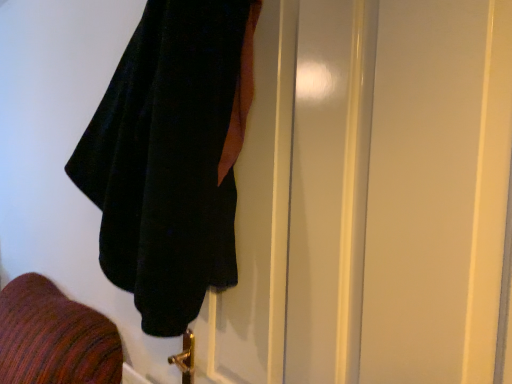
The image size is (512, 384). Find the location of `velvet black towel at upper left`. velvet black towel at upper left is located at coordinates (170, 157).

What do you see at coordinates (170, 157) in the screenshot? I see `velvet black towel at upper left` at bounding box center [170, 157].

Measure the distance between velvet black towel at upper left and camera.

28.39 inches.

The height and width of the screenshot is (384, 512). What do you see at coordinates (405, 187) in the screenshot? I see `velvet black coat at upper left` at bounding box center [405, 187].

This screenshot has height=384, width=512. In order to click on velvet black coat at upper left in this screenshot , I will do 405,187.

Find the location of a particular element. The image size is (512, 384). velvet black towel at upper left is located at coordinates (170, 157).

From the picture: Which is more to the right, velvet black towel at upper left or velvet black coat at upper left?

Positioned to the right is velvet black coat at upper left.

Is velvet black towel at upper left in front of velvet black coat at upper left?

No, the depth of velvet black towel at upper left is greater than that of velvet black coat at upper left.

Considering the positions of points (170, 158) and (384, 381), is point (170, 158) farther from camera compared to point (384, 381)?

Yes, point (170, 158) is behind point (384, 381).

From the image's perspective, which one is positioned higher, velvet black towel at upper left or velvet black coat at upper left?

velvet black towel at upper left.

From a real-world perspective, between velvet black towel at upper left and velvet black coat at upper left, who is vertically higher?

velvet black towel at upper left, from a real-world perspective.

Looking at their sizes, would you say velvet black towel at upper left is wider or thinner than velvet black coat at upper left?

Considering their sizes, velvet black towel at upper left looks broader than velvet black coat at upper left.

Which of these two, velvet black towel at upper left or velvet black coat at upper left, stands taller?

velvet black coat at upper left.

Is velvet black towel at upper left bigger than velvet black coat at upper left?

Yes, velvet black towel at upper left is bigger than velvet black coat at upper left.

Is velvet black towel at upper left spatially inside velvet black coat at upper left, or outside of it?

velvet black towel at upper left is not enclosed by velvet black coat at upper left.

Is velvet black towel at upper left far from velvet black coat at upper left?

velvet black towel at upper left is actually quite close to velvet black coat at upper left.

Is velvet black towel at upper left facing towards velvet black coat at upper left?

No, velvet black towel at upper left is not oriented towards velvet black coat at upper left.

Can you tell me how much velvet black towel at upper left and velvet black coat at upper left differ in facing direction?

10.1 degrees separate the facing orientations of velvet black towel at upper left and velvet black coat at upper left.

Where is `towel above the velvet black coat at upper left (from a real-world perspective)`? The height and width of the screenshot is (384, 512). towel above the velvet black coat at upper left (from a real-world perspective) is located at coordinates (170, 157).

Looking at this image, between velvet black coat at upper left and velvet black towel at upper left, which one appears on the left side from the viewer's perspective?

velvet black towel at upper left.

Between velvet black coat at upper left and velvet black towel at upper left, which one is positioned behind?

velvet black towel at upper left is further from the camera.

Does point (380, 342) come behind point (248, 33)?

No.

From the image's perspective, is velvet black coat at upper left positioned above or below velvet black towel at upper left?

From the image's perspective, velvet black coat at upper left appears below velvet black towel at upper left.

Consider the image. From a real-world perspective, which is physically above, velvet black coat at upper left or velvet black towel at upper left?

In real-world perspective, velvet black towel at upper left is above.

Consider the image. Which object is wider, velvet black coat at upper left or velvet black towel at upper left?

velvet black towel at upper left is wider.

Which of these two, velvet black coat at upper left or velvet black towel at upper left, stands shorter?

velvet black towel at upper left is shorter.

Based on their sizes in the image, would you say velvet black coat at upper left is bigger or smaller than velvet black towel at upper left?

In the image, velvet black coat at upper left appears to be smaller than velvet black towel at upper left.

Is velvet black coat at upper left inside or outside of velvet black towel at upper left?

velvet black coat at upper left is located beyond the bounds of velvet black towel at upper left.

Are velvet black coat at upper left and velvet black towel at upper left far apart?

No, velvet black coat at upper left is not far away from velvet black towel at upper left.

Is velvet black coat at upper left facing away from velvet black towel at upper left?

That's not correct — velvet black coat at upper left is not looking away from velvet black towel at upper left.

Can you tell me how much velvet black coat at upper left and velvet black towel at upper left differ in facing direction?

The angle between the facing direction of velvet black coat at upper left and the facing direction of velvet black towel at upper left is 10.1 degrees.

The width and height of the screenshot is (512, 384). In order to click on towel above the velvet black coat at upper left (from the image's perspective) in this screenshot , I will do `click(170, 157)`.

You are a GUI agent. You are given a task and a screenshot of the screen. Output one action in this format:
    pyautogui.click(x=<x>, y=<y>)
    Task: Click on the screen door located underneath the velvet black towel at upper left (from a real-world perspective)
    Image resolution: width=512 pixels, height=384 pixels.
    Given the screenshot: What is the action you would take?
    pyautogui.click(x=405, y=187)

This screenshot has width=512, height=384. I want to click on towel above the velvet black coat at upper left (from the image's perspective), so click(170, 157).